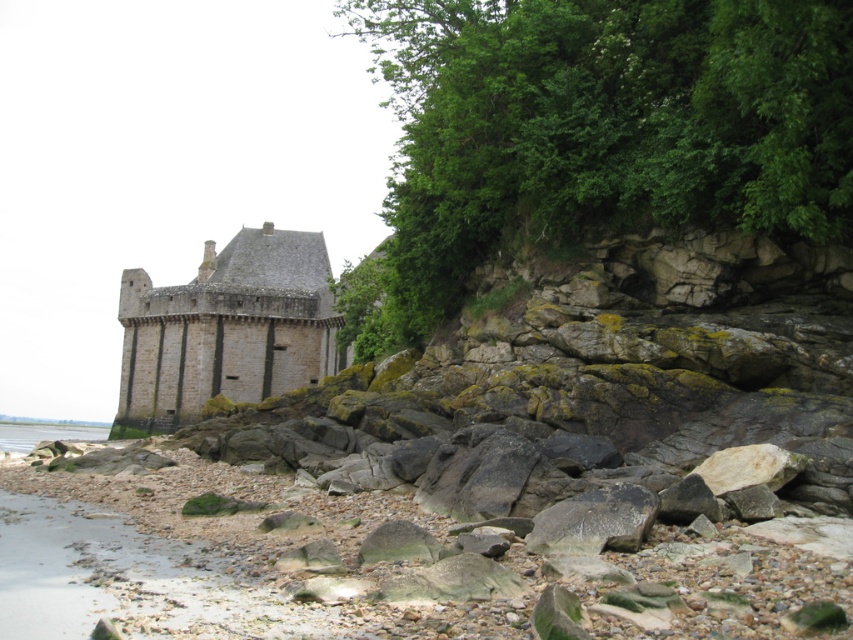
Question: Which object is positioned closest to the stone gray castle at center?

Choices:
 (A) smooth pebbles at lower left
 (B) clear water at lower left
 (C) green leafy tree at upper right

Answer: (C)

Question: Can you confirm if green leafy tree at upper right is positioned to the right of clear water at lower left?

Choices:
 (A) yes
 (B) no

Answer: (A)

Question: In this image, where is smooth pebbles at lower left located relative to clear water at lower left?

Choices:
 (A) right
 (B) left

Answer: (A)

Question: Observing the image, what is the correct spatial positioning of green leafy tree at upper right in reference to smooth pebbles at lower left?

Choices:
 (A) below
 (B) above

Answer: (B)

Question: Which object is closer to the camera taking this photo?

Choices:
 (A) stone gray castle at center
 (B) clear water at lower left

Answer: (B)

Question: Which object is farther from the camera taking this photo?

Choices:
 (A) stone gray castle at center
 (B) green leafy tree at upper right

Answer: (A)